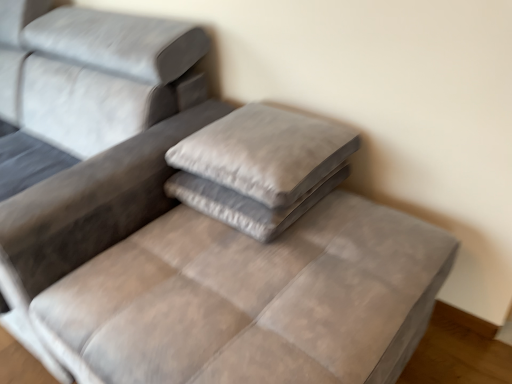
At what (x,y) coordinates should I click in order to perform the action: click on suede gray pillow at center, which is counted as the first pillow, starting from the top. Please return your answer as a coordinate pair (x, y). Looking at the image, I should click on coord(265,152).

Where is `velvet gray mattress at center`? velvet gray mattress at center is located at coordinates (252, 300).

Which is more to the right, velvet gray mattress at center or suede gray pillow at center, which is counted as the first pillow, starting from the top?

suede gray pillow at center, which is counted as the first pillow, starting from the top, is more to the right.

Is velvet gray mattress at center smaller than suede gray pillow at center, which is counted as the first pillow, starting from the top?

No.

The image size is (512, 384). There is a velvet gray mattress at center. Find the location of `the 2nd pillow above it (from the image's perspective)`. the 2nd pillow above it (from the image's perspective) is located at coordinates pyautogui.click(x=265, y=152).

In the scene shown: Is suede gray pillow at center, placed as the second pillow when sorted from bottom to top, outside of velvet gray mattress at center?

Indeed, suede gray pillow at center, placed as the second pillow when sorted from bottom to top, is completely outside velvet gray mattress at center.

From a real-world perspective, which is physically below, suede gray pillow at center, which is counted as the first pillow, starting from the top, or velvet gray mattress at center?

velvet gray mattress at center.

From the image's perspective, is suede gray pillow at center, which is counted as the first pillow, starting from the top, located above velvet gray mattress at center?

Indeed, from the image's perspective, suede gray pillow at center, which is counted as the first pillow, starting from the top, is shown above velvet gray mattress at center.

Which is more to the left, suede gray pillow at center, which is counted as the first pillow, starting from the top, or velvet gray mattress at center?

velvet gray mattress at center.

Considering the relative sizes of velvet gray mattress at center and velvet gray pillow at center, which appears as the first pillow when ordered from the bottom, in the image provided, is velvet gray mattress at center taller than velvet gray pillow at center, which appears as the first pillow when ordered from the bottom,?

Correct, velvet gray mattress at center is much taller as velvet gray pillow at center, which appears as the first pillow when ordered from the bottom.

Would you say velvet gray mattress at center is inside or outside velvet gray pillow at center, which appears as the first pillow when ordered from the bottom?

velvet gray mattress at center exists outside the volume of velvet gray pillow at center, which appears as the first pillow when ordered from the bottom.

In the image, there is a velvet gray pillow at center, which appears as the first pillow when ordered from the bottom. Identify the location of mattress below it (from the image's perspective). (252, 300).

Which point is more distant from viewer, (295, 289) or (207, 210)?

The point (207, 210) is farther from the camera.

Is point (330, 187) in front of point (250, 173)?

No, (330, 187) is further to viewer.

From the picture: Which object is positioned more to the left, velvet gray pillow at center, which appears as the first pillow when ordered from the bottom, or suede gray pillow at center, placed as the second pillow when sorted from bottom to top?

suede gray pillow at center, placed as the second pillow when sorted from bottom to top.

Is velvet gray pillow at center, the 2th pillow viewed from the top, positioned before suede gray pillow at center, placed as the second pillow when sorted from bottom to top?

No, velvet gray pillow at center, the 2th pillow viewed from the top, is behind suede gray pillow at center, placed as the second pillow when sorted from bottom to top.

From a real-world perspective, which is physically below, velvet gray pillow at center, the 2th pillow viewed from the top, or velvet gray mattress at center?

From a 3D spatial view, velvet gray mattress at center is below.

From the image's perspective, which is below, velvet gray pillow at center, the 2th pillow viewed from the top, or velvet gray mattress at center?

velvet gray mattress at center is shown below in the image.

Based on their sizes in the image, would you say velvet gray pillow at center, the 2th pillow viewed from the top, is bigger or smaller than velvet gray mattress at center?

velvet gray pillow at center, the 2th pillow viewed from the top, is smaller than velvet gray mattress at center.

Considering the sizes of objects velvet gray pillow at center, which appears as the first pillow when ordered from the bottom, and velvet gray mattress at center in the image provided, who is shorter, velvet gray pillow at center, which appears as the first pillow when ordered from the bottom, or velvet gray mattress at center?

With less height is velvet gray pillow at center, which appears as the first pillow when ordered from the bottom.

Is suede gray pillow at center, which is counted as the first pillow, starting from the top, next to velvet gray pillow at center, which appears as the first pillow when ordered from the bottom?

suede gray pillow at center, which is counted as the first pillow, starting from the top, is not next to velvet gray pillow at center, which appears as the first pillow when ordered from the bottom, and they're not touching.

Can you tell me how much suede gray pillow at center, placed as the second pillow when sorted from bottom to top, and velvet gray pillow at center, which appears as the first pillow when ordered from the bottom, differ in facing direction?

0.000103 degrees.

Is suede gray pillow at center, which is counted as the first pillow, starting from the top, spatially inside velvet gray pillow at center, which appears as the first pillow when ordered from the bottom, or outside of it?

suede gray pillow at center, which is counted as the first pillow, starting from the top, cannot be found inside velvet gray pillow at center, which appears as the first pillow when ordered from the bottom.

In the scene shown: Which is nearer, (305, 122) or (266, 231)?

Point (305, 122) is positioned farther from the camera compared to point (266, 231).

Identify the location of the 1st pillow behind the velvet gray mattress at center. click(265, 152).

You are a GUI agent. You are given a task and a screenshot of the screen. Output one action in this format:
    pyautogui.click(x=<x>, y=<y>)
    Task: Click on the mattress below the suede gray pillow at center, which is counted as the first pillow, starting from the top (from a real-world perspective)
    The height and width of the screenshot is (384, 512).
    Given the screenshot: What is the action you would take?
    pyautogui.click(x=252, y=300)

Estimate the real-world distances between objects in this image. Which object is further from suede gray pillow at center, placed as the second pillow when sorted from bottom to top, velvet gray pillow at center, which appears as the first pillow when ordered from the bottom, or velvet gray mattress at center?

Among the two, velvet gray mattress at center is located further to suede gray pillow at center, placed as the second pillow when sorted from bottom to top.

From the image, which object appears to be nearer to velvet gray pillow at center, which appears as the first pillow when ordered from the bottom, suede gray pillow at center, placed as the second pillow when sorted from bottom to top, or velvet gray mattress at center?

Among the two, suede gray pillow at center, placed as the second pillow when sorted from bottom to top, is located nearer to velvet gray pillow at center, which appears as the first pillow when ordered from the bottom.

From the image, which object appears to be farther from velvet gray mattress at center, velvet gray pillow at center, which appears as the first pillow when ordered from the bottom, or suede gray pillow at center, placed as the second pillow when sorted from bottom to top?

suede gray pillow at center, placed as the second pillow when sorted from bottom to top, is further to velvet gray mattress at center.

Which object lies further to the anchor point suede gray pillow at center, placed as the second pillow when sorted from bottom to top, velvet gray mattress at center or velvet gray pillow at center, which appears as the first pillow when ordered from the bottom?

Among the two, velvet gray mattress at center is located further to suede gray pillow at center, placed as the second pillow when sorted from bottom to top.

Considering their positions, is velvet gray mattress at center positioned closer to velvet gray pillow at center, the 2th pillow viewed from the top, than suede gray pillow at center, placed as the second pillow when sorted from bottom to top?

Among the two, suede gray pillow at center, placed as the second pillow when sorted from bottom to top, is located nearer to velvet gray pillow at center, the 2th pillow viewed from the top.

Estimate the real-world distances between objects in this image. Which object is further from velvet gray mattress at center, suede gray pillow at center, which is counted as the first pillow, starting from the top, or velvet gray pillow at center, the 2th pillow viewed from the top?

suede gray pillow at center, which is counted as the first pillow, starting from the top, is positioned further to the anchor velvet gray mattress at center.

Where is `pillow that lies between suede gray pillow at center, placed as the second pillow when sorted from bottom to top, and velvet gray mattress at center from top to bottom`? pillow that lies between suede gray pillow at center, placed as the second pillow when sorted from bottom to top, and velvet gray mattress at center from top to bottom is located at coordinates (248, 203).